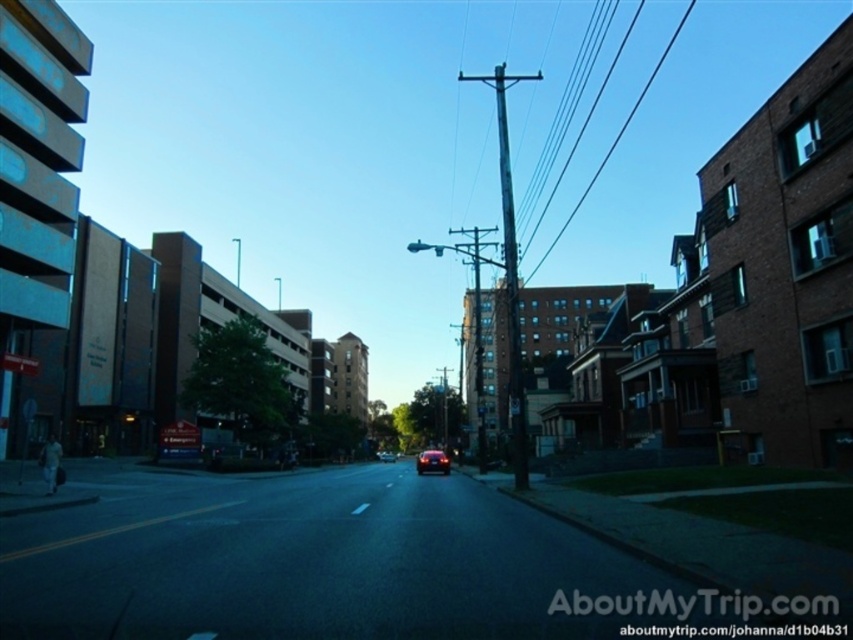
Can you confirm if weathered wood telegraph pole at center is positioned below metallic wire at center?

Correct, weathered wood telegraph pole at center is located below metallic wire at center.

Is weathered wood telegraph pole at center closer to camera compared to metallic wire at center?

That is True.

The width and height of the screenshot is (853, 640). Describe the element at coordinates (509, 269) in the screenshot. I see `weathered wood telegraph pole at center` at that location.

Where is `weathered wood telegraph pole at center`? The width and height of the screenshot is (853, 640). weathered wood telegraph pole at center is located at coordinates (509, 269).

This screenshot has height=640, width=853. Find the location of `weathered wood telegraph pole at center`. weathered wood telegraph pole at center is located at coordinates (509, 269).

Is point (601, 172) positioned behind point (379, 452)?

That is True.

Does metallic wire at center have a lesser height compared to shiny silver sedan at center?

No, metallic wire at center is not shorter than shiny silver sedan at center.

What do you see at coordinates (616, 136) in the screenshot?
I see `metallic wire at center` at bounding box center [616, 136].

Find the location of a particular element. The height and width of the screenshot is (640, 853). metallic wire at center is located at coordinates (616, 136).